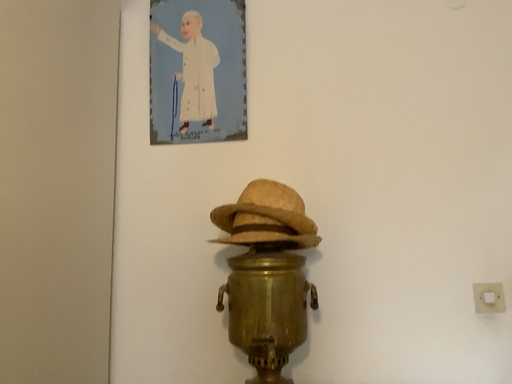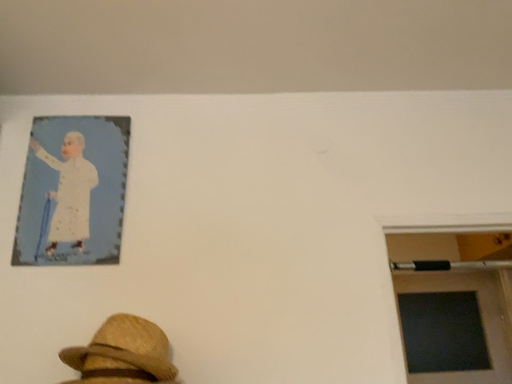
Question: How did the camera likely rotate when shooting the video?

Choices:
 (A) rotated upward
 (B) rotated downward

Answer: (A)